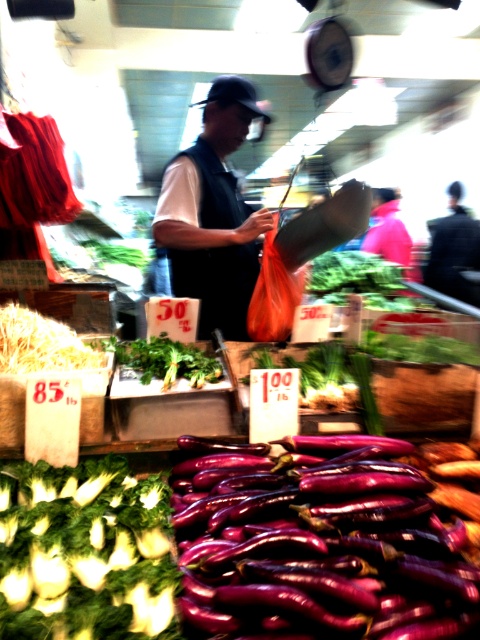
You are standing at the point marked by coordinates point (84, 552) in the market scene. What object are you closest to?

The point (84, 552) corresponds to the green leafy at lower left.

Looking at this image, you are a customer at the market and see the dark blue jeans at center and the green leafy at center. Which item is located below the other?

The dark blue jeans at center is positioned over green leafy at center, so the green leafy at center is located below the dark blue jeans at center.

You are a customer at the market and want to know which item is shorter between the green leafy at lower left and the dark blue vest at center. According to the scene, which one is shorter?

The green leafy at lower left has a lesser height compared to dark blue vest at center, so the green leafy at lower left is shorter.